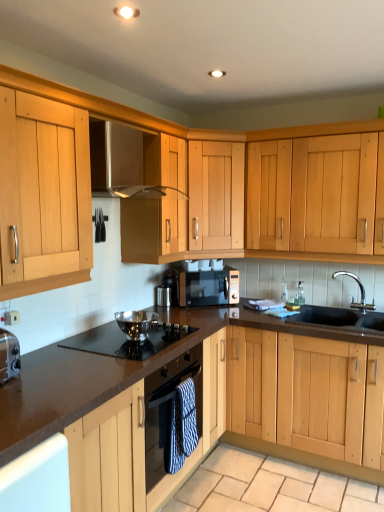
Locate an element on the screen. Image resolution: width=384 pixels, height=512 pixels. free location above brown laminate countertop at center (from a real-world perspective) is located at coordinates (71, 367).